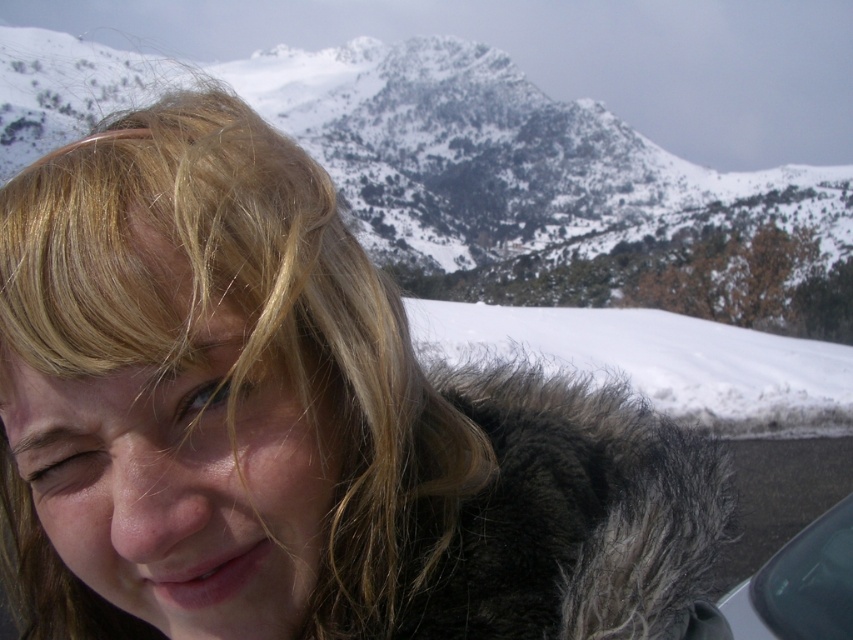
Question: Among these objects, which one is farthest from the camera?

Choices:
 (A) white fluffy snow at lower right
 (B) transparent glass car window at lower right
 (C) snowy rocky mountain at upper center

Answer: (C)

Question: Among these points, which one is farthest from the camera?

Choices:
 (A) (820, 624)
 (B) (648, 324)

Answer: (B)

Question: Considering the real-world distances, which object is closest to the snowy rocky mountain at upper center?

Choices:
 (A) transparent glass car window at lower right
 (B) white fluffy snow at lower right

Answer: (B)

Question: In this image, where is snowy rocky mountain at upper center located relative to white fluffy snow at lower right?

Choices:
 (A) left
 (B) right

Answer: (A)

Question: Is snowy rocky mountain at upper center above white fluffy snow at lower right?

Choices:
 (A) no
 (B) yes

Answer: (B)

Question: Can you confirm if snowy rocky mountain at upper center is positioned to the left of white fluffy snow at lower right?

Choices:
 (A) no
 (B) yes

Answer: (B)